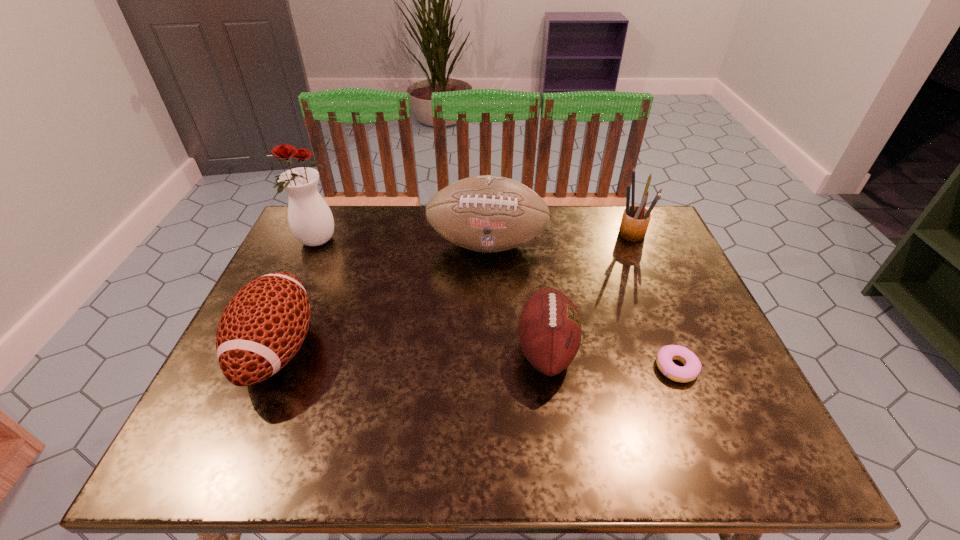
Where is `object situated at the far right corner`? The width and height of the screenshot is (960, 540). object situated at the far right corner is located at coordinates (635, 220).

The width and height of the screenshot is (960, 540). In order to click on free location at the far edge of the desktop in this screenshot , I will do [x=605, y=225].

The image size is (960, 540). Find the location of `vacant space at the near edge`. vacant space at the near edge is located at coordinates (413, 466).

This screenshot has height=540, width=960. Identify the location of vacant area at the left edge of the desktop. (320, 265).

In order to click on free region at the right edge of the desktop in this screenshot , I will do `click(675, 320)`.

Locate an element on the screen. vacant area that lies between the tallest object and the farthest football (American) is located at coordinates (402, 244).

I want to click on unoccupied position between the shortest football (American) and the second tallest football (American), so point(412,349).

This screenshot has height=540, width=960. In order to click on free spot between the farthest football (American) and the pencil box in this screenshot , I will do `click(559, 239)`.

This screenshot has width=960, height=540. I want to click on free point between the farthest football (American) and the second tallest football (American), so click(382, 297).

The height and width of the screenshot is (540, 960). In order to click on unoccupied area between the doughnut and the vase in this screenshot , I will do pos(496,305).